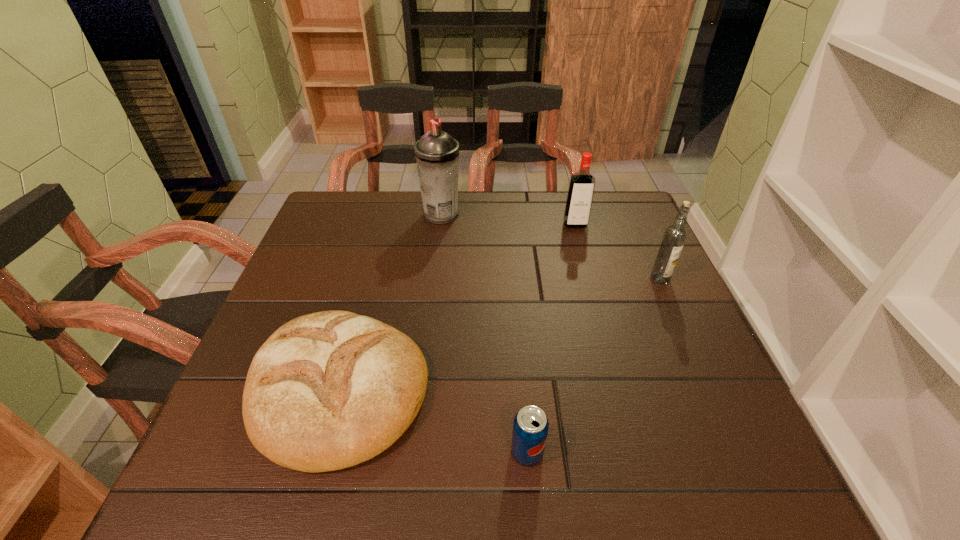
This screenshot has height=540, width=960. In order to click on free space located 0.380m on the back of the third object from left to right in this screenshot , I will do `click(514, 289)`.

Image resolution: width=960 pixels, height=540 pixels. I want to click on vacant region located on the back of the bread, so click(365, 295).

Where is `aerosol can at the far edge`? The width and height of the screenshot is (960, 540). aerosol can at the far edge is located at coordinates (437, 153).

The image size is (960, 540). Identify the location of vodka that is at the far edge. (581, 188).

The width and height of the screenshot is (960, 540). Identify the location of pop soda present at the near edge. (530, 427).

Find the location of a particular element. This screenshot has width=960, height=540. bread present at the near edge is located at coordinates pyautogui.click(x=329, y=390).

Image resolution: width=960 pixels, height=540 pixels. I want to click on object located in the left edge section of the desktop, so (329, 390).

Where is `object that is at the right edge`? This screenshot has width=960, height=540. object that is at the right edge is located at coordinates (674, 237).

Where is `object present at the near left corner`? object present at the near left corner is located at coordinates (329, 390).

Identify the location of vacant space at the far edge of the desktop. (496, 233).